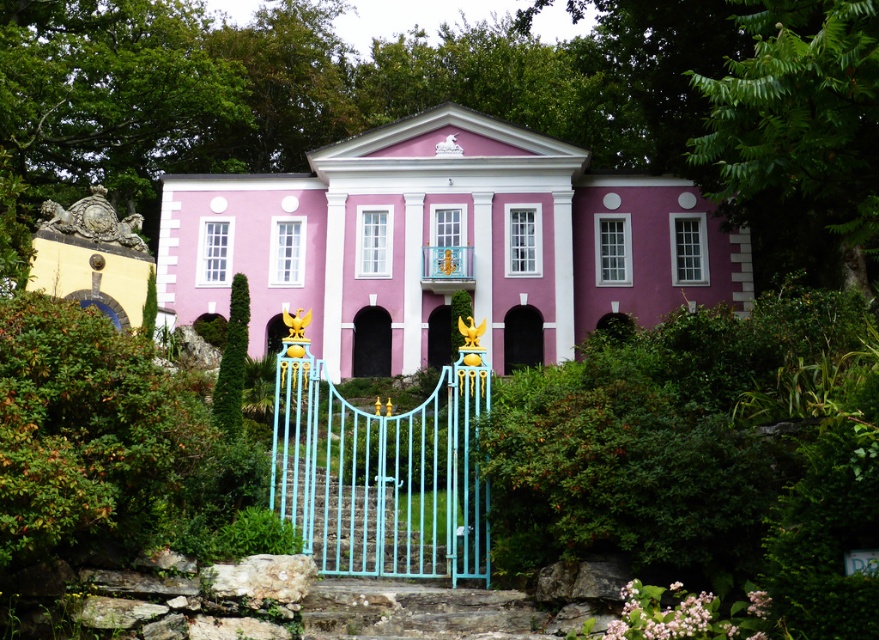
Question: Does light blue painted metal gate at center appear on the right side of black stone archway at center?

Choices:
 (A) no
 (B) yes

Answer: (A)

Question: Estimate the real-world distances between objects in this image. Which object is closer to the metallic gold door at center?

Choices:
 (A) pink matte door at center
 (B) light blue painted metal gate at center
 (C) rustic stone stairs at center

Answer: (A)

Question: Can you confirm if light blue painted metal gate at center is positioned to the right of metallic gold door at center?

Choices:
 (A) yes
 (B) no

Answer: (B)

Question: Which point is closer to the camera?

Choices:
 (A) (389, 320)
 (B) (413, 529)
 (C) (538, 324)
 (D) (442, 349)

Answer: (B)

Question: Based on their relative distances, which object is nearer to the rustic stone stairs at center?

Choices:
 (A) metallic gold door at center
 (B) light blue painted metal gate at center
 (C) pink matte door at center
 (D) black stone archway at center

Answer: (B)

Question: In this image, where is light blue painted metal gate at center located relative to rustic stone stairs at center?

Choices:
 (A) left
 (B) right

Answer: (A)